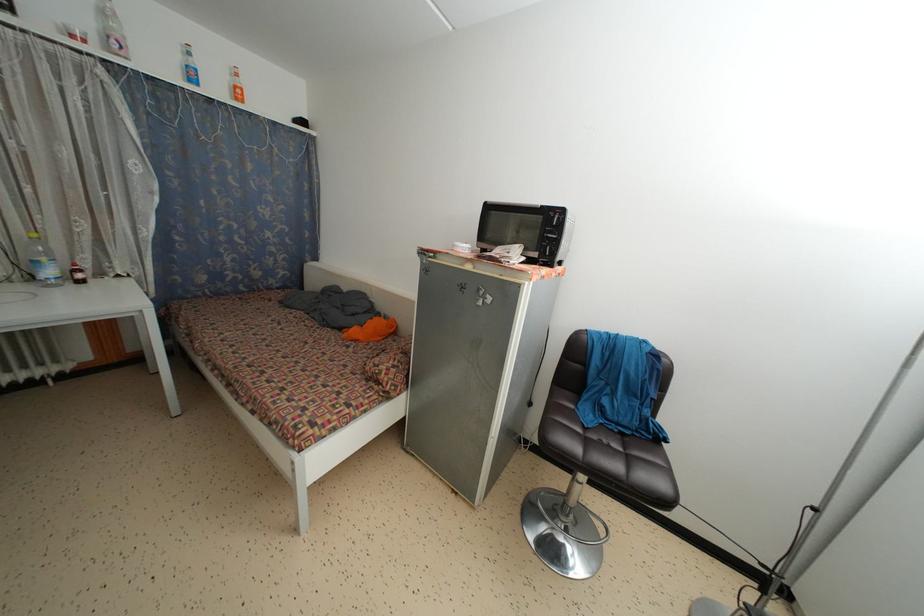
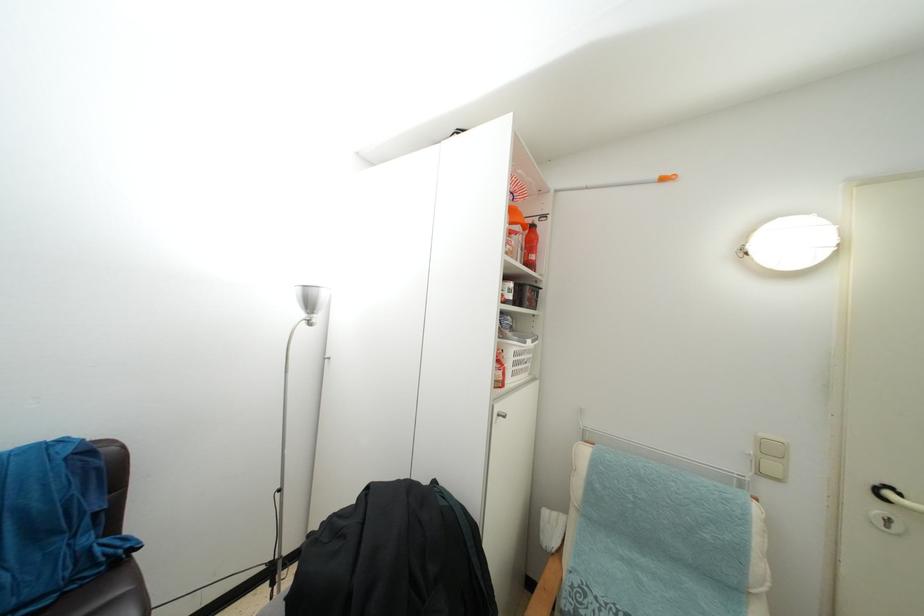
Question: The camera is either moving clockwise (left) or counter-clockwise (right) around the object. The first image is from the beginning of the video and the second image is from the end. Is the camera moving left or right when shooting the video?

Choices:
 (A) Left
 (B) Right

Answer: (A)